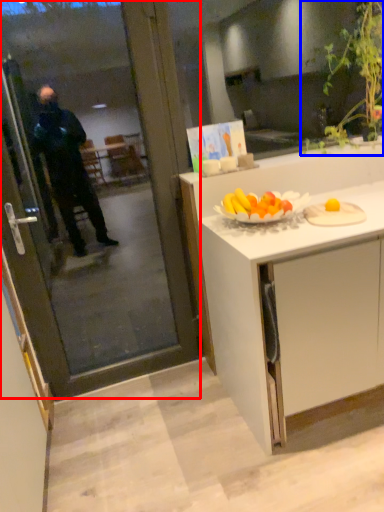
Question: Which object appears closest to the camera in this image, screen door (highlighted by a red box) or houseplant (highlighted by a blue box)?

Choices:
 (A) screen door
 (B) houseplant

Answer: (A)